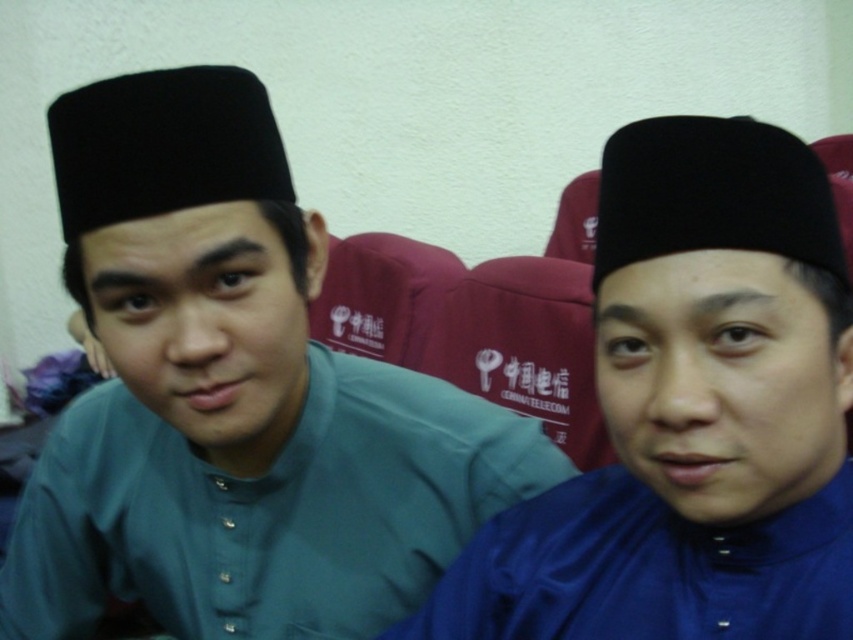
Can you confirm if matte green shirt at center is positioned below blue satin robe at right?

No.

Is matte green shirt at center above blue satin robe at right?

Correct, matte green shirt at center is located above blue satin robe at right.

Is point (207, 461) positioned behind point (514, 572)?

Yes, point (207, 461) is farther from viewer.

You are a GUI agent. You are given a task and a screenshot of the screen. Output one action in this format:
    pyautogui.click(x=<x>, y=<y>)
    Task: Click on the matte green shirt at center
    The width and height of the screenshot is (853, 640).
    Given the screenshot: What is the action you would take?
    pyautogui.click(x=233, y=397)

Is blue satin robe at right shorter than black felt hat at upper center?

No, blue satin robe at right is not shorter than black felt hat at upper center.

Between blue satin robe at right and black felt hat at upper center, which one appears on the right side from the viewer's perspective?

black felt hat at upper center is more to the right.

This screenshot has width=853, height=640. Identify the location of blue satin robe at right. (645, 570).

Is matte green shirt at center to the right of blue satin hat at center from the viewer's perspective?

Incorrect, matte green shirt at center is not on the right side of blue satin hat at center.

This screenshot has width=853, height=640. What do you see at coordinates (233, 397) in the screenshot?
I see `matte green shirt at center` at bounding box center [233, 397].

Where is `matte green shirt at center`? The width and height of the screenshot is (853, 640). matte green shirt at center is located at coordinates (233, 397).